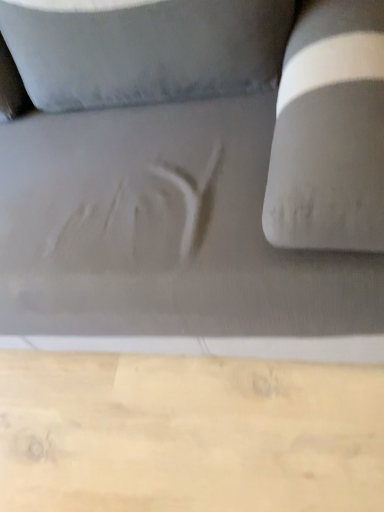
The image size is (384, 512). In order to click on free space above wooden plank at lower center (from a real-world perspective) in this screenshot , I will do `click(157, 435)`.